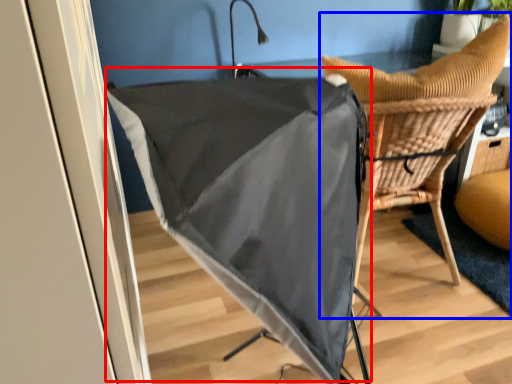
Question: Which object is further to the camera taking this photo, umbrella (highlighted by a red box) or chair (highlighted by a blue box)?

Choices:
 (A) umbrella
 (B) chair

Answer: (B)